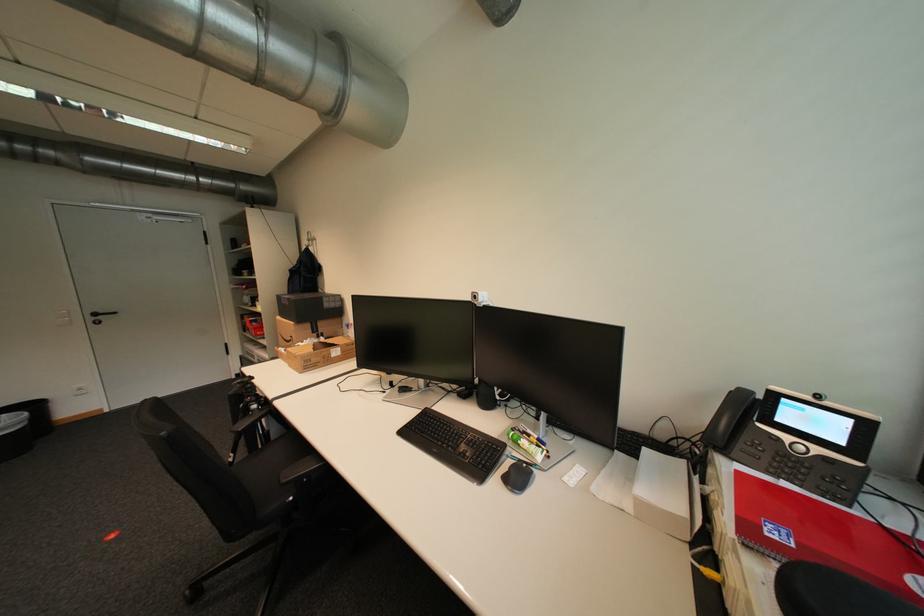
Which object does [478,297] point to?

It corresponds to the white webcam in the image.